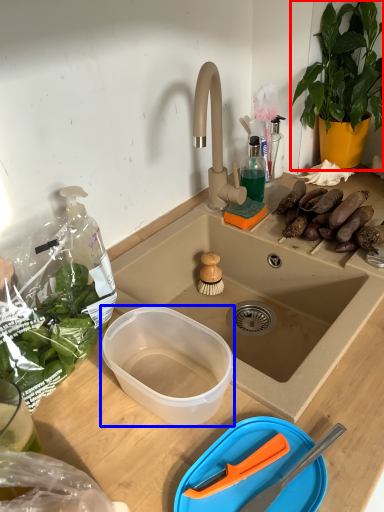
Question: Which point is closer to the camera, houseplant (highlighted by a red box) or bowl (highlighted by a blue box)?

Choices:
 (A) houseplant
 (B) bowl

Answer: (B)